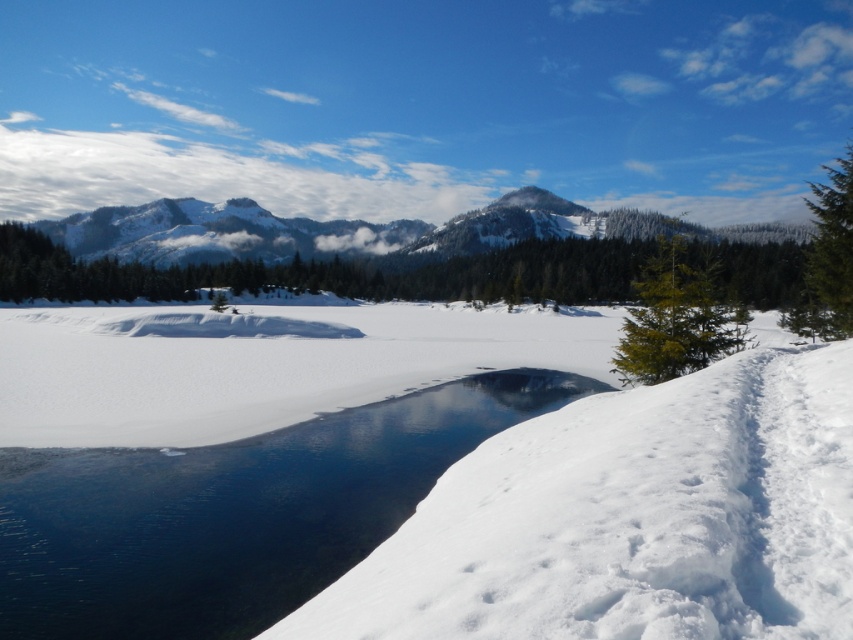
Which is above, green matte tree at center or green matte tree at right?

Positioned higher is green matte tree at center.

Is point (758, 289) positioned after point (695, 278)?

Yes, point (758, 289) is farther from viewer.

Locate an element on the screen. The height and width of the screenshot is (640, 853). green matte tree at center is located at coordinates (334, 273).

Who is shorter, green matte tree at center or green textured pine at right?

Standing shorter between the two is green matte tree at center.

Identify the location of green matte tree at center. Image resolution: width=853 pixels, height=640 pixels. pos(334,273).

Does white fluffy snow at lower left have a larger size compared to green matte tree at center?

Actually, white fluffy snow at lower left might be smaller than green matte tree at center.

Is white fluffy snow at lower left thinner than green matte tree at center?

Indeed, white fluffy snow at lower left has a lesser width compared to green matte tree at center.

This screenshot has height=640, width=853. Find the location of `white fluffy snow at lower left`. white fluffy snow at lower left is located at coordinates (631, 518).